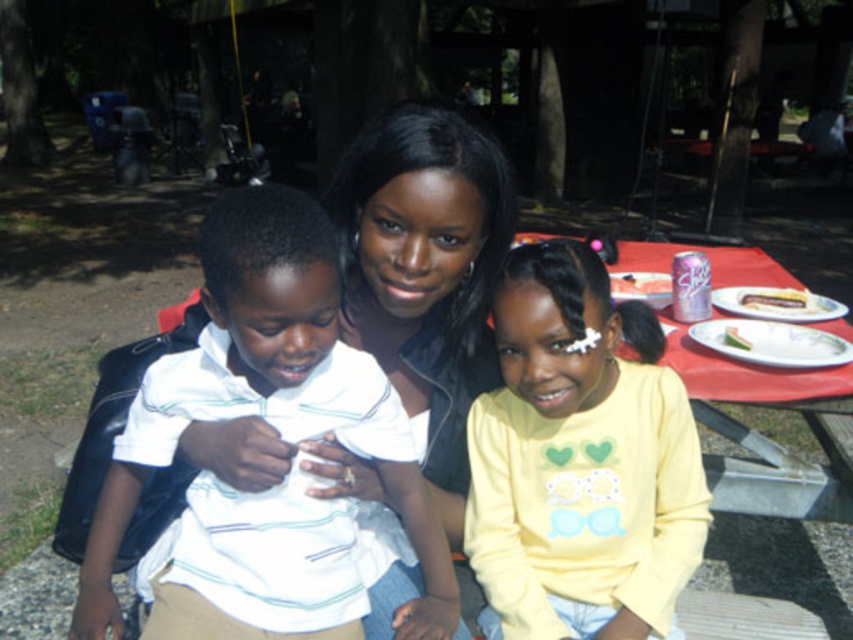
You are standing in the picnic area and want to hand the green leafy vegetable at center to the person wearing the white striped shirt at center. Which object should you reach for first, and why?

You should reach for the white striped shirt at center first because it is closer to you than the green leafy vegetable at center, so you can hand the vegetable to them by first approaching the shirt wearer.

You are at a picnic and want to place a napkin on the table between the white porcelain plate at right and the green leafy vegetable at center. Based on their positions, where should you place the napkin?

The white porcelain plate at right is located below the green leafy vegetable at center, so you should place the napkin above the white porcelain plate at right and below the green leafy vegetable at center to position it between them.